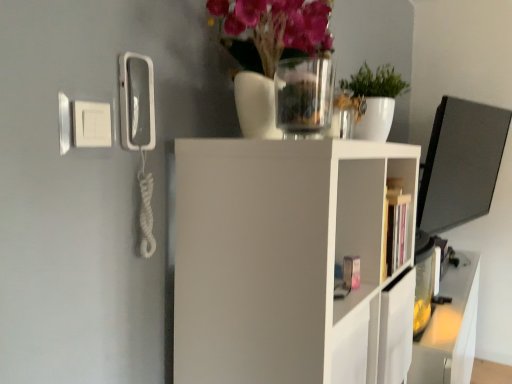
Question: Does translucent glass vase at upper center have a greater height compared to transparent glass vase at upper center?

Choices:
 (A) yes
 (B) no

Answer: (A)

Question: Is translucent glass vase at upper center closer to the viewer compared to transparent glass vase at upper center?

Choices:
 (A) no
 (B) yes

Answer: (B)

Question: Would you say translucent glass vase at upper center is a long distance from transparent glass vase at upper center?

Choices:
 (A) yes
 (B) no

Answer: (B)

Question: From the image's perspective, is translucent glass vase at upper center located beneath transparent glass vase at upper center?

Choices:
 (A) no
 (B) yes

Answer: (A)

Question: Is the surface of translucent glass vase at upper center in direct contact with transparent glass vase at upper center?

Choices:
 (A) no
 (B) yes

Answer: (B)

Question: Considering the relative positions of translucent glass vase at upper center and transparent glass vase at upper center in the image provided, is translucent glass vase at upper center to the right of transparent glass vase at upper center from the viewer's perspective?

Choices:
 (A) yes
 (B) no

Answer: (B)

Question: Is translucent glass vase at upper center completely or partially outside of white matte shelf at center?

Choices:
 (A) no
 (B) yes

Answer: (B)

Question: From a real-world perspective, is translucent glass vase at upper center beneath white matte shelf at center?

Choices:
 (A) no
 (B) yes

Answer: (A)

Question: Can you confirm if translucent glass vase at upper center is wider than white matte shelf at center?

Choices:
 (A) yes
 (B) no

Answer: (B)

Question: Considering the relative sizes of translucent glass vase at upper center and white matte shelf at center in the image provided, is translucent glass vase at upper center smaller than white matte shelf at center?

Choices:
 (A) no
 (B) yes

Answer: (B)

Question: Is the position of translucent glass vase at upper center more distant than that of white matte shelf at center?

Choices:
 (A) no
 (B) yes

Answer: (B)

Question: Is translucent glass vase at upper center to the left of white matte shelf at center from the viewer's perspective?

Choices:
 (A) no
 (B) yes

Answer: (B)

Question: Is transparent glass vase at upper center to the right of translucent glass vase at upper center from the viewer's perspective?

Choices:
 (A) yes
 (B) no

Answer: (A)